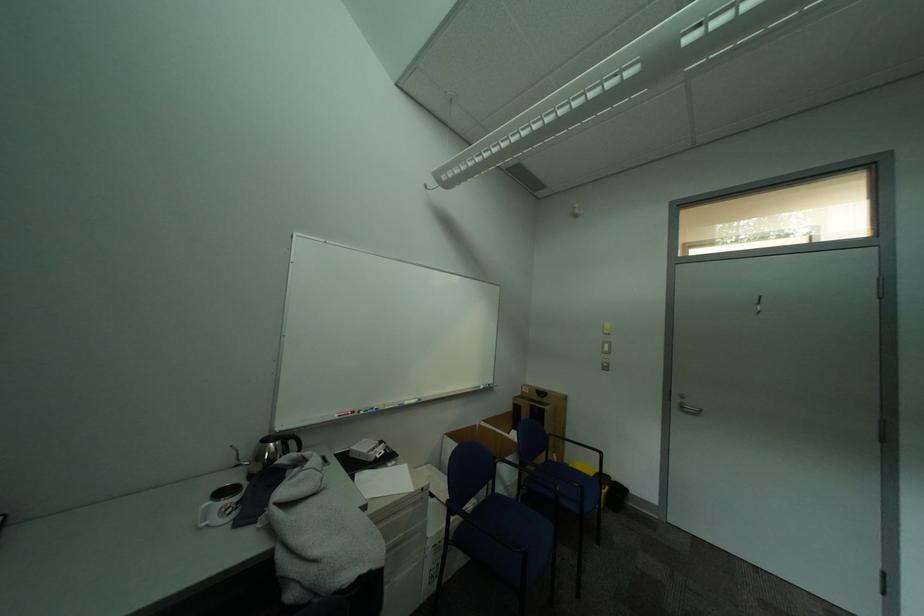
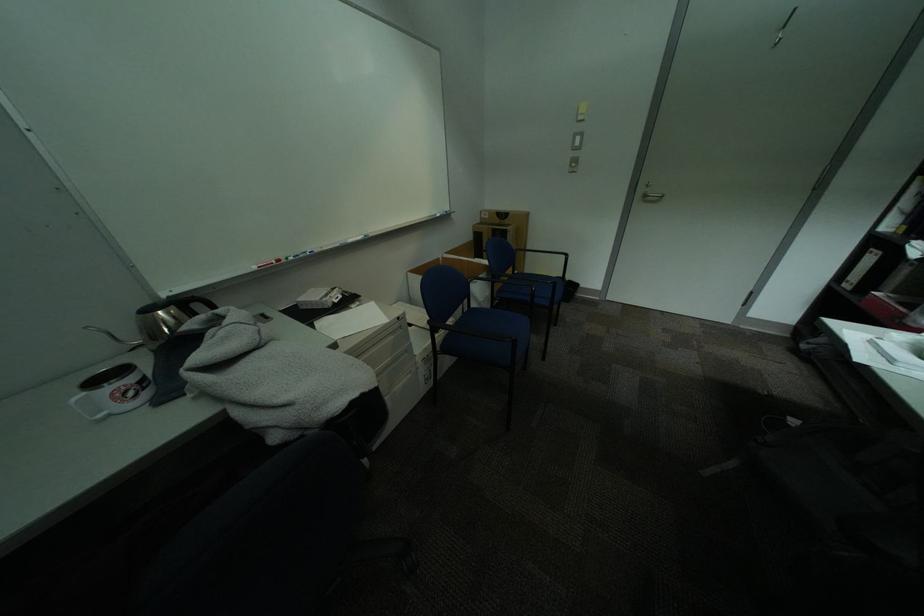
In the second image, find the point that corresponds to pixel 305 436 in the first image.

(204, 297)